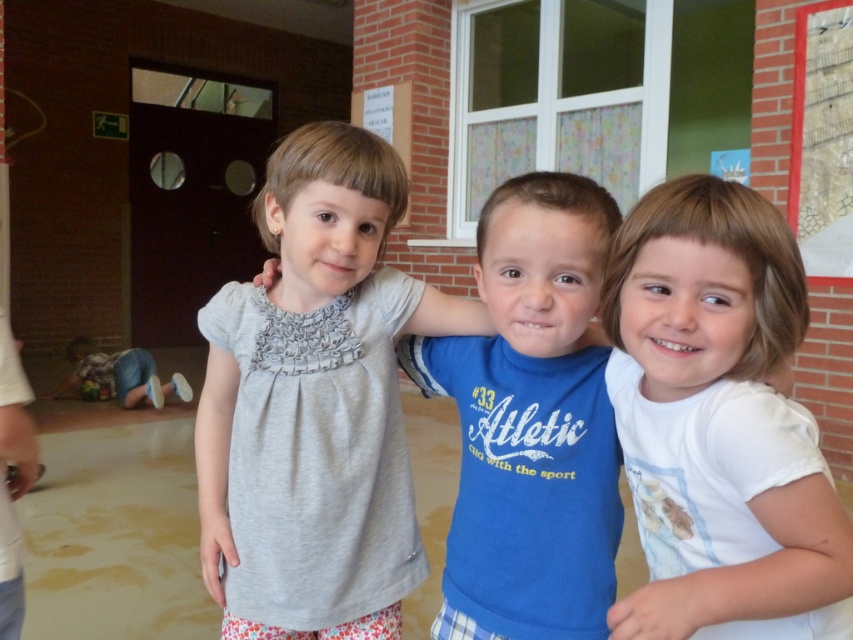
Question: Among these points, which one is nearest to the camera?

Choices:
 (A) (186, 388)
 (B) (636, 250)
 (C) (213, 572)

Answer: (B)

Question: Does white cotton shirt at right have a smaller size compared to blue cotton shirt at center?

Choices:
 (A) no
 (B) yes

Answer: (B)

Question: Is matte gray shirt at center positioned in front of blue denim jeans at lower left?

Choices:
 (A) yes
 (B) no

Answer: (A)

Question: Which object is farther from the camera taking this photo?

Choices:
 (A) white cotton shirt at right
 (B) blue cotton shirt at center
 (C) matte gray shirt at center
 (D) blue denim jeans at lower left

Answer: (D)

Question: Considering the relative positions of matte gray shirt at center and blue cotton shirt at center in the image provided, where is matte gray shirt at center located with respect to blue cotton shirt at center?

Choices:
 (A) right
 (B) left

Answer: (B)

Question: Considering the real-world distances, which object is farthest from the white cotton shirt at right?

Choices:
 (A) blue denim jeans at lower left
 (B) matte gray shirt at center
 (C) blue cotton shirt at center

Answer: (A)